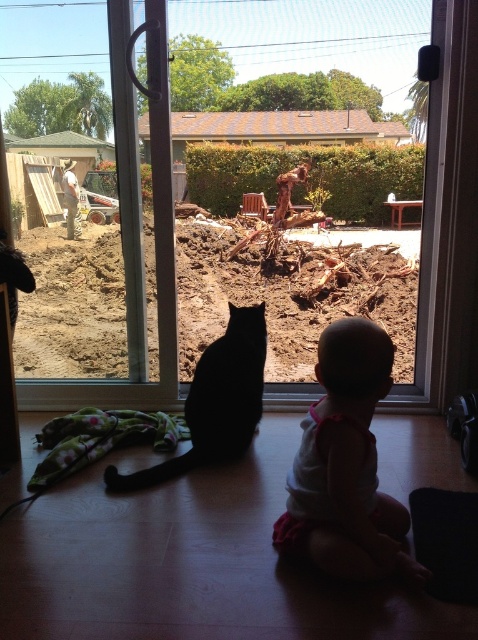
Question: Which point is farther to the camera?

Choices:
 (A) black matte cat at center
 (B) white fabric baby at center
 (C) transparent glass window at center

Answer: (C)

Question: Is transparent glass window at center smaller than white fabric baby at center?

Choices:
 (A) yes
 (B) no

Answer: (B)

Question: Which point appears farthest from the camera in this image?

Choices:
 (A) (162, 346)
 (B) (289, 513)

Answer: (A)

Question: Is transparent glass window at center smaller than white fabric baby at center?

Choices:
 (A) yes
 (B) no

Answer: (B)

Question: Can you confirm if transparent glass window at center is positioned to the left of black matte cat at center?

Choices:
 (A) no
 (B) yes

Answer: (A)

Question: Which object is farther from the camera taking this photo?

Choices:
 (A) white fabric baby at center
 (B) transparent glass window at center
 (C) black matte cat at center

Answer: (B)